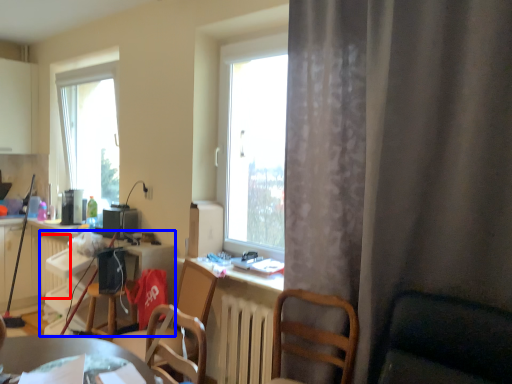
Question: Which object is closer to the camera taking this photo, radiator (highlighted by a red box) or computer desk (highlighted by a blue box)?

Choices:
 (A) radiator
 (B) computer desk

Answer: (B)